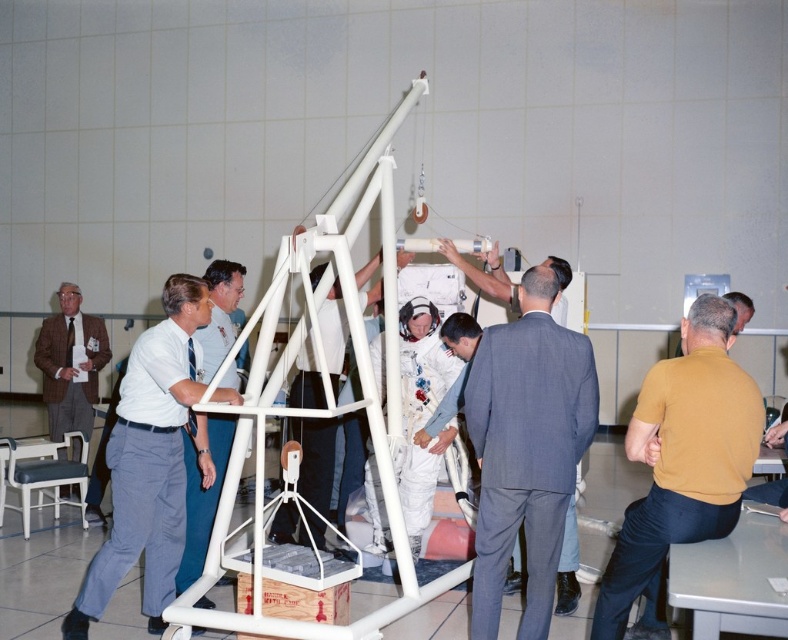
You are an engineer analyzing the structure in the scene. You have two points marked on the structure at coordinates point (478, 524) and point (655, 406). Which point is closer to you when you are facing the structure?

Point (478, 524) is further to the viewer than point (655, 406), so the point closer to you is point (655, 406).